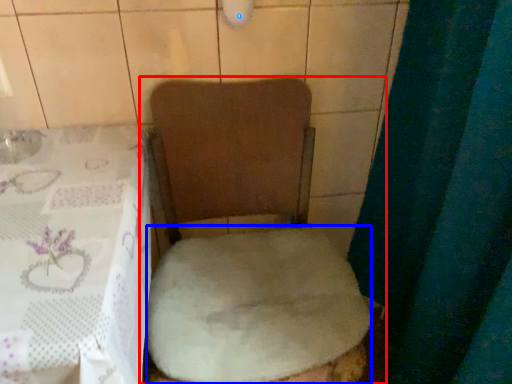
Question: Which object is closer to the camera taking this photo, toilet (highlighted by a red box) or sheet (highlighted by a blue box)?

Choices:
 (A) toilet
 (B) sheet

Answer: (A)